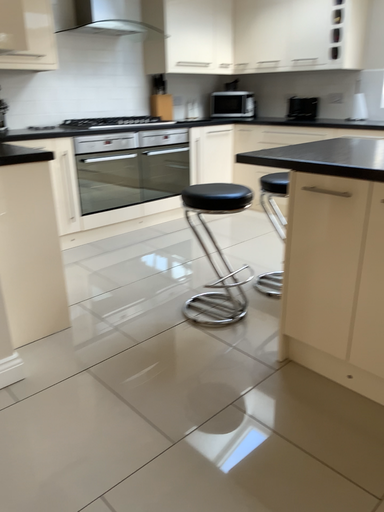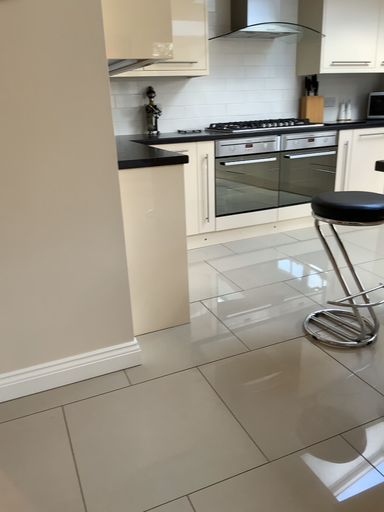
Question: How did the camera likely rotate when shooting the video?

Choices:
 (A) rotated left
 (B) rotated right

Answer: (A)